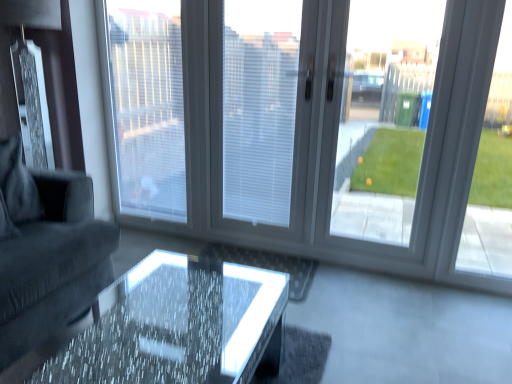
Locate an element on the screen. The image size is (512, 384). translucent glass table at center is located at coordinates (179, 327).

The width and height of the screenshot is (512, 384). In order to click on dark gray fabric couch at left in this screenshot , I will do `click(46, 251)`.

You are a GUI agent. You are given a task and a screenshot of the screen. Output one action in this format:
    pyautogui.click(x=<x>, y=<y>)
    Task: Click on the transparent glass window at center
    The height and width of the screenshot is (384, 512).
    Given the screenshot: What is the action you would take?
    pyautogui.click(x=334, y=142)

Which is in front, point (291, 21) or point (178, 70)?

Positioned in front is point (291, 21).

Measure the distance from white textured blinds at center, which ranks as the second window screen in right-to-left order, to white textured blinds at center, positioned as the 3th window screen in right-to-left order.

20.91 inches.

From the image's perspective, which object appears higher, white textured blinds at center, which ranks as the second window screen in right-to-left order, or white textured blinds at center, positioned as the 3th window screen in right-to-left order?

white textured blinds at center, positioned as the 3th window screen in right-to-left order, is shown above in the image.

Looking at this image, considering the relative sizes of white textured blinds at center, which is the second window screen in left-to-right order, and white textured blinds at center, positioned as the 3th window screen in right-to-left order, in the image provided, is white textured blinds at center, which is the second window screen in left-to-right order, taller than white textured blinds at center, positioned as the 3th window screen in right-to-left order,?

In fact, white textured blinds at center, which is the second window screen in left-to-right order, may be shorter than white textured blinds at center, positioned as the 3th window screen in right-to-left order.

Could you tell me if transparent glass door at right, arranged as the 1th window screen when viewed from the right, is facing dark gray fabric couch at left?

No, transparent glass door at right, arranged as the 1th window screen when viewed from the right, does not turn towards dark gray fabric couch at left.

Considering the sizes of transparent glass door at right, arranged as the 3th window screen when viewed from the left, and dark gray fabric couch at left in the image, is transparent glass door at right, arranged as the 3th window screen when viewed from the left, taller or shorter than dark gray fabric couch at left?

In the image, transparent glass door at right, arranged as the 3th window screen when viewed from the left, appears to be taller than dark gray fabric couch at left.

Which object is closer to the camera, transparent glass door at right, arranged as the 3th window screen when viewed from the left, or dark gray fabric couch at left?

dark gray fabric couch at left is more forward.

Consider the image. What's the angular difference between transparent glass door at right, arranged as the 3th window screen when viewed from the left, and dark gray fabric couch at left's facing directions?

transparent glass door at right, arranged as the 3th window screen when viewed from the left, and dark gray fabric couch at left are facing 90.1 degrees away from each other.

Between dark gray fabric couch at left and transparent glass door at right, arranged as the 1th window screen when viewed from the right, which one has larger width?

dark gray fabric couch at left is wider.

Consider the image. From a real-world perspective, is dark gray fabric couch at left above or below transparent glass door at right, arranged as the 1th window screen when viewed from the right?

dark gray fabric couch at left is below transparent glass door at right, arranged as the 1th window screen when viewed from the right.

Is dark gray fabric couch at left completely or partially outside of transparent glass door at right, arranged as the 3th window screen when viewed from the left?

Yes, dark gray fabric couch at left is located beyond the bounds of transparent glass door at right, arranged as the 3th window screen when viewed from the left.

Is dark gray fabric couch at left turned away from transparent glass door at right, arranged as the 3th window screen when viewed from the left?

No, dark gray fabric couch at left is not facing away from transparent glass door at right, arranged as the 3th window screen when viewed from the left.

Does point (429, 123) come closer to viewer compared to point (355, 159)?

That is True.

In the image, is transparent glass window at center positioned in front of or behind transparent glass door at right, arranged as the 1th window screen when viewed from the right?

Clearly, transparent glass window at center is in front of transparent glass door at right, arranged as the 1th window screen when viewed from the right.

Find the location of a particular element. The height and width of the screenshot is (384, 512). the 1st window screen behind when counting from the transparent glass window at center is located at coordinates (384, 116).

Looking at this image, considering the sizes of objects transparent glass window at center and transparent glass door at right, arranged as the 3th window screen when viewed from the left, in the image provided, who is wider, transparent glass window at center or transparent glass door at right, arranged as the 3th window screen when viewed from the left,?

transparent glass door at right, arranged as the 3th window screen when viewed from the left, is wider.

Considering the positions of points (183, 356) and (77, 203), is point (183, 356) closer to camera compared to point (77, 203)?

Yes, it is in front of point (77, 203).

Which of these two, translucent glass table at center or dark gray fabric couch at left, stands taller?

With more height is dark gray fabric couch at left.

From the image's perspective, does translucent glass table at center appear lower than dark gray fabric couch at left?

Yes, from the image's perspective, translucent glass table at center is beneath dark gray fabric couch at left.

Is translucent glass table at center positioned behind dark gray fabric couch at left?

No, it is in front of dark gray fabric couch at left.

Considering the points (471, 65) and (80, 246), which point is in front, point (471, 65) or point (80, 246)?

The point (80, 246) is closer to the camera.

Is transparent glass window at center not close to dark gray fabric couch at left?

That's right, there is a large distance between transparent glass window at center and dark gray fabric couch at left.

From a real-world perspective, is transparent glass window at center physically above dark gray fabric couch at left?

Indeed, from a real-world perspective, transparent glass window at center stands above dark gray fabric couch at left.

Where is `window above the dark gray fabric couch at left (from the image's perspective)`? The image size is (512, 384). window above the dark gray fabric couch at left (from the image's perspective) is located at coordinates pyautogui.click(x=334, y=142).

Considering the relative positions of dark gray fabric couch at left and transparent glass window at center in the image provided, is dark gray fabric couch at left to the right of transparent glass window at center from the viewer's perspective?

No.

Which point is more forward, (x=24, y=310) or (x=113, y=176)?

The point (x=24, y=310) is in front.

From a real-world perspective, which object stands above the other?

transparent glass window at center.

You are a GUI agent. You are given a task and a screenshot of the screen. Output one action in this format:
    pyautogui.click(x=<x>, y=<y>)
    Task: Click on the window screen above the white textured blinds at center, positioned as the 1th window screen in left-to-right order (from a real-world perspective)
    The height and width of the screenshot is (384, 512).
    Given the screenshot: What is the action you would take?
    pyautogui.click(x=259, y=108)

Where is `studio couch in front of the transparent glass door at right, arranged as the 3th window screen when viewed from the left`? This screenshot has height=384, width=512. studio couch in front of the transparent glass door at right, arranged as the 3th window screen when viewed from the left is located at coordinates (46, 251).

Looking at the image, which one is located closer to white textured blinds at center, which is the second window screen in left-to-right order, white plastic window frame at right or transparent glass door at right, arranged as the 1th window screen when viewed from the right?

The object closer to white textured blinds at center, which is the second window screen in left-to-right order, is white plastic window frame at right.

Looking at the image, which one is located further to transparent glass door at right, arranged as the 3th window screen when viewed from the left, translucent glass table at center or white plastic window frame at right?

Among the two, translucent glass table at center is located further to transparent glass door at right, arranged as the 3th window screen when viewed from the left.

Estimate the real-world distances between objects in this image. Which object is closer to translucent glass table at center, white plastic window frame at right or dark gray fabric couch at left?

dark gray fabric couch at left lies closer to translucent glass table at center than the other object.

When comparing their distances from white textured blinds at center, positioned as the 1th window screen in left-to-right order, does translucent glass table at center or transparent glass door at right, arranged as the 3th window screen when viewed from the left, seem closer?

translucent glass table at center is positioned closer to the anchor white textured blinds at center, positioned as the 1th window screen in left-to-right order.

Looking at the image, which one is located further to white plastic window frame at right, white textured blinds at center, positioned as the 3th window screen in right-to-left order, or transparent glass window at center?

white textured blinds at center, positioned as the 3th window screen in right-to-left order, lies further to white plastic window frame at right than the other object.

In the scene shown: Considering their positions, is transparent glass door at right, arranged as the 1th window screen when viewed from the right, positioned closer to translucent glass table at center than white textured blinds at center, which ranks as the second window screen in right-to-left order?

white textured blinds at center, which ranks as the second window screen in right-to-left order, is positioned closer to the anchor translucent glass table at center.

Looking at the image, which one is located closer to transparent glass door at right, arranged as the 3th window screen when viewed from the left, translucent glass table at center or white textured blinds at center, positioned as the 1th window screen in left-to-right order?

white textured blinds at center, positioned as the 1th window screen in left-to-right order, is positioned closer to the anchor transparent glass door at right, arranged as the 3th window screen when viewed from the left.

Estimate the real-world distances between objects in this image. Which object is closer to dark gray fabric couch at left, white textured blinds at center, positioned as the 3th window screen in right-to-left order, or white plastic window frame at right?

Among the two, white textured blinds at center, positioned as the 3th window screen in right-to-left order, is located nearer to dark gray fabric couch at left.

Identify the location of studio couch between translucent glass table at center and white textured blinds at center, which is the second window screen in left-to-right order, from front to back. (46, 251).

Find the location of a particular element. table between dark gray fabric couch at left and transparent glass door at right, arranged as the 1th window screen when viewed from the right, from left to right is located at coordinates (179, 327).

This screenshot has width=512, height=384. In order to click on table between dark gray fabric couch at left and white plastic window frame at right from left to right in this screenshot , I will do `click(179, 327)`.

The image size is (512, 384). Find the location of `window screen between white textured blinds at center, which is the second window screen in left-to-right order, and white plastic window frame at right from left to right`. window screen between white textured blinds at center, which is the second window screen in left-to-right order, and white plastic window frame at right from left to right is located at coordinates (384, 116).